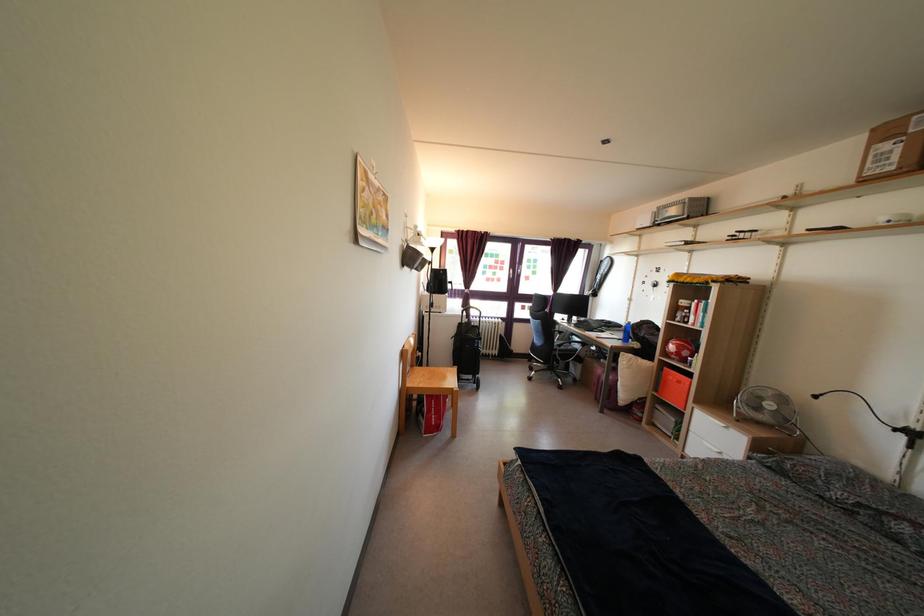
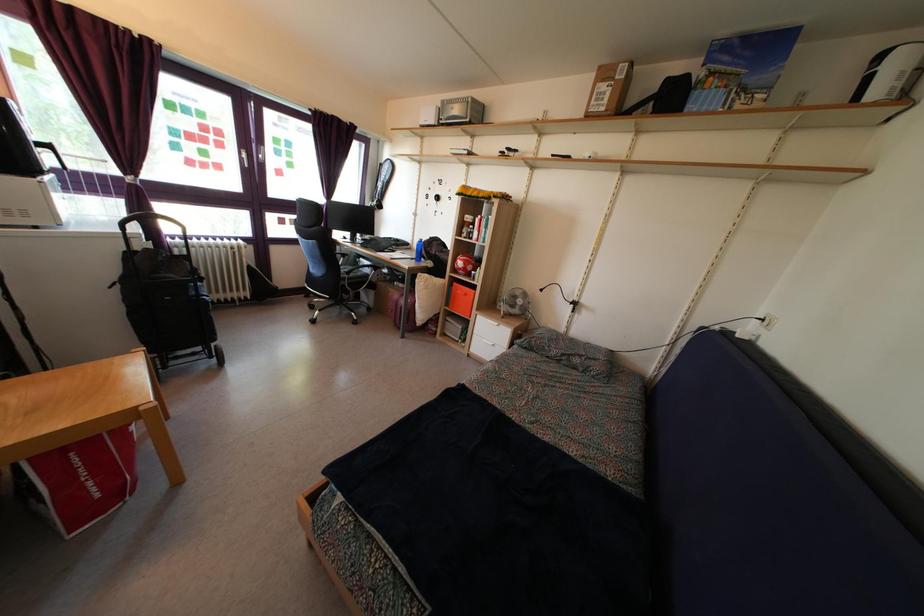
Find the pixel in the second image that matches point (687, 310) in the first image.

(470, 227)